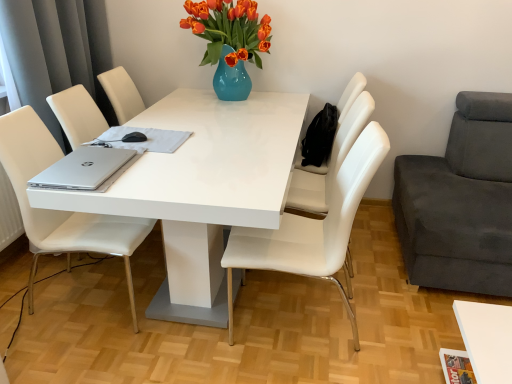
Image resolution: width=512 pixels, height=384 pixels. In order to click on spots to the right of white leather chair at center, the 2th chair in the left-to-right sequence in this screenshot , I will do `click(394, 318)`.